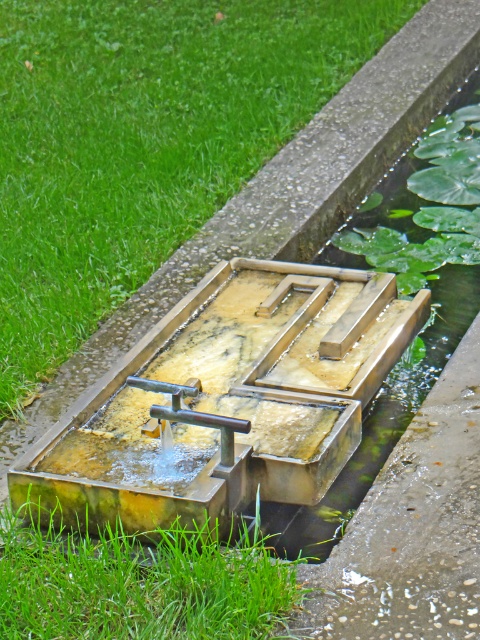
You are standing at point A and want to reach the fountain. The fountain is located at the center of the image. There is a point marked at coordinates (x=142, y=584). What is the direction of the fountain relative to this point?

The fountain is located at the center of the image, so from point (x=142, y=584), the fountain is in the upper right direction.

You are standing at the center of the fountain and looking towards the point marked as point (143,140). What do you see in that direction?

You see green grass at upper left in that direction.

In the scene shown: You are standing at the edge of the fountain and want to walk towards the point labeled as point (181, 388). However, there is an obstacle at point (257, 637). Can you safely walk around the obstacle to reach your destination?

Point (257, 637) is in front of point (181, 388), so you cannot safely walk around the obstacle to reach your destination because the obstacle is blocking the path directly in front of the destination.